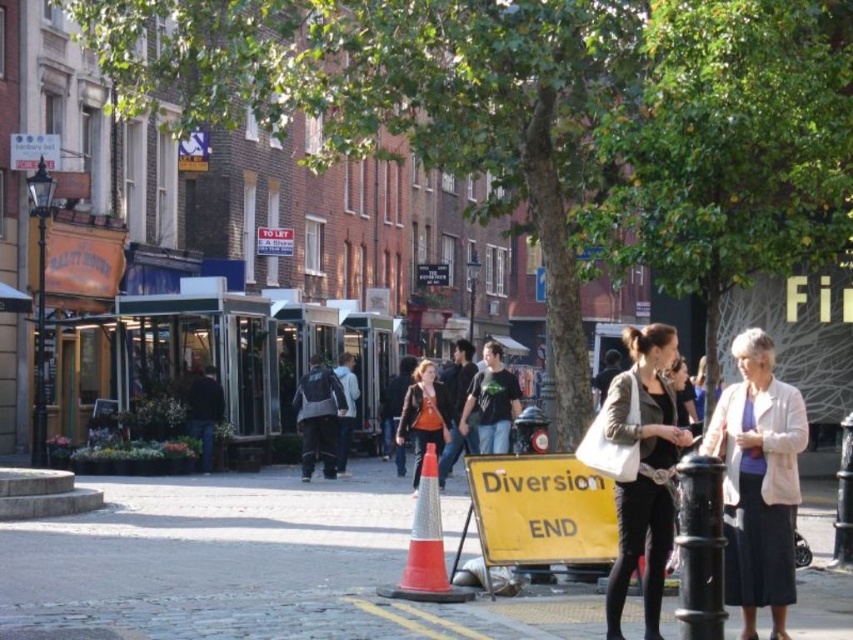
Can you confirm if cobblestone pavement at center is taller than light beige jacket at lower right?

In fact, cobblestone pavement at center may be shorter than light beige jacket at lower right.

Identify the location of cobblestone pavement at center. (251, 564).

Who is more distant from viewer, (550, 616) or (775, 522)?

The point (550, 616) is behind.

What are the coordinates of `cobblestone pavement at center` in the screenshot? It's located at (251, 564).

Between light beige jacket at lower right and matte white bag at center, which one appears on the left side from the viewer's perspective?

Positioned to the left is matte white bag at center.

Which is below, light beige jacket at lower right or matte white bag at center?

matte white bag at center is below.

Describe the element at coordinates (758, 481) in the screenshot. The height and width of the screenshot is (640, 853). I see `light beige jacket at lower right` at that location.

Where is `light beige jacket at lower right`? Image resolution: width=853 pixels, height=640 pixels. light beige jacket at lower right is located at coordinates (758, 481).

Is matte white bag at center thinner than leather jacket at center?

No, matte white bag at center is not thinner than leather jacket at center.

Can you confirm if matte white bag at center is positioned above leather jacket at center?

Incorrect, matte white bag at center is not positioned above leather jacket at center.

Who is more forward, (643, 376) or (416, 410)?

Point (643, 376) is more forward.

Locate an element on the screen. matte white bag at center is located at coordinates (643, 472).